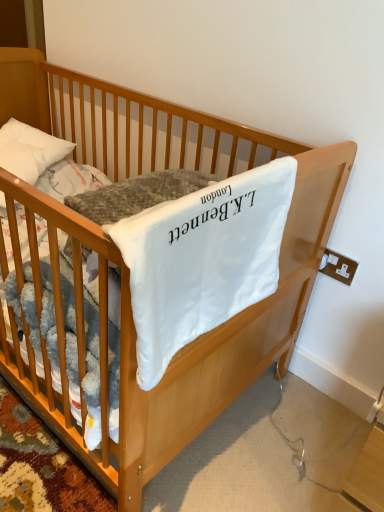
Find the location of a particular element. This screenshot has width=384, height=512. white soft blanket at center is located at coordinates (202, 259).

What do you see at coordinates (202, 259) in the screenshot?
I see `white soft blanket at center` at bounding box center [202, 259].

This screenshot has width=384, height=512. Find the location of `white soft blanket at center`. white soft blanket at center is located at coordinates (202, 259).